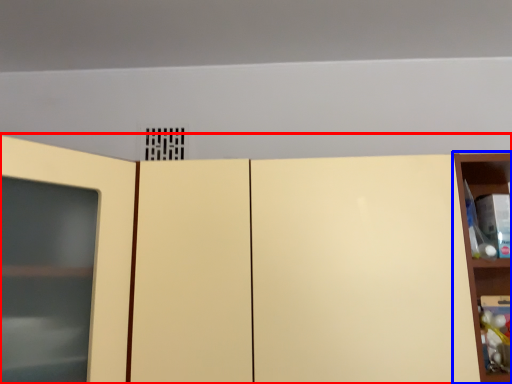
Question: Which object appears closest to the camera in this image, cupboard (highlighted by a red box) or shelf (highlighted by a blue box)?

Choices:
 (A) cupboard
 (B) shelf

Answer: (A)